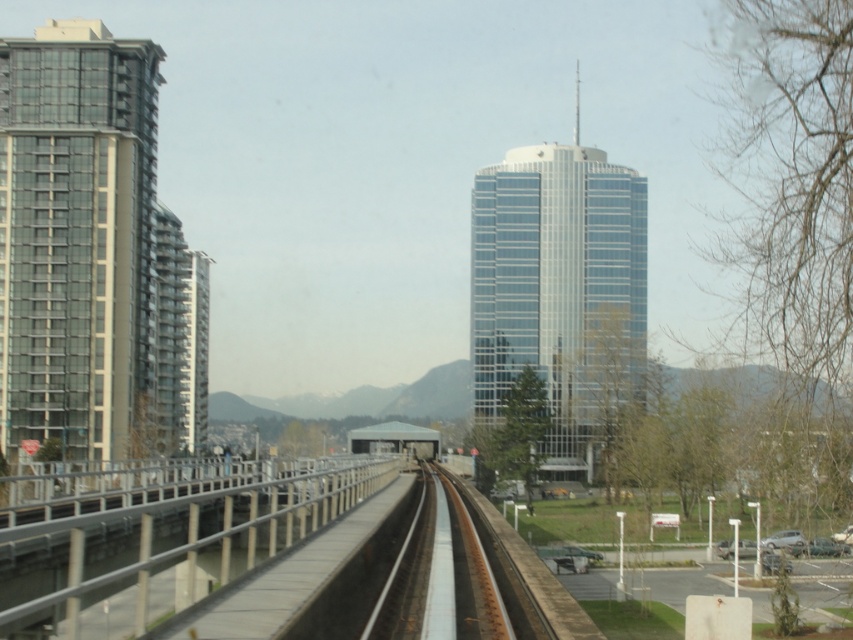
Question: Is the position of glassy concrete building at left more distant than that of glassy blue skyscraper at center?

Choices:
 (A) no
 (B) yes

Answer: (A)

Question: Which of the following is the farthest from the observer?

Choices:
 (A) [x=410, y=572]
 (B) [x=625, y=326]
 (C) [x=114, y=64]

Answer: (B)

Question: Estimate the real-world distances between objects in this image. Which object is farther from the smooth steel tracks at center?

Choices:
 (A) white metal rail at center
 (B) glassy concrete building at left

Answer: (B)

Question: Is glassy blue skyscraper at center to the right of smooth steel tracks at center from the viewer's perspective?

Choices:
 (A) yes
 (B) no

Answer: (A)

Question: Which of these objects is positioned closest to the smooth steel tracks at center?

Choices:
 (A) glassy concrete building at left
 (B) glassy blue skyscraper at center
 (C) white metal rail at center

Answer: (C)

Question: Does glassy blue skyscraper at center have a lesser width compared to smooth steel tracks at center?

Choices:
 (A) yes
 (B) no

Answer: (B)